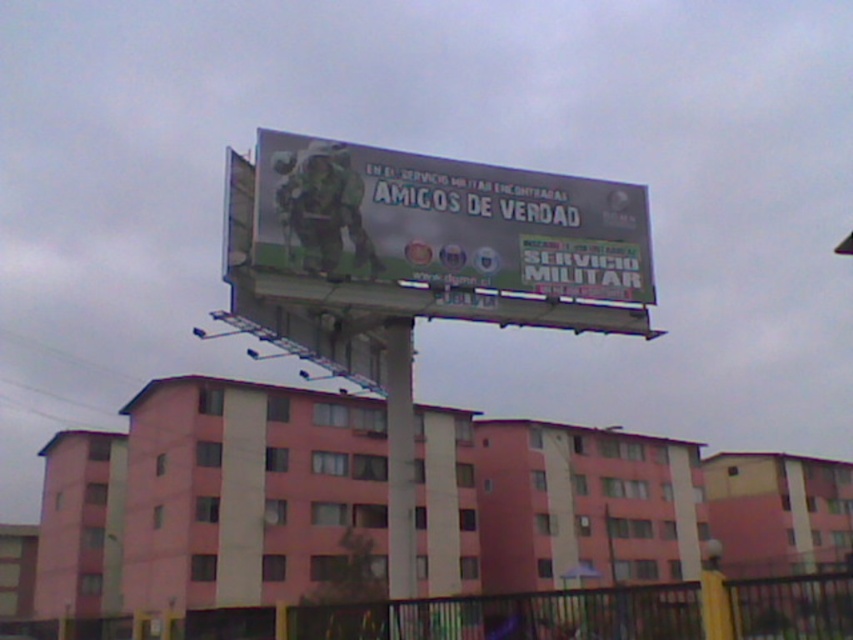
Looking at this image, you are a drone operator trying to capture a closeup of the metallic silver soldier at center on the billboard. The billboard is 10 meters wide and 5 meters tall. The soldier is placed at coordinates 0.347 in the x direction and 0.524 in the y direction. Calculate the exact position in meters from the bottom left corner of the billboard to the soldier. Round to the nearest centimeter.

The metallic silver soldier at center is located at x coordinate 0.347 multiplied by the billboard width of 10 meters, which equals 3.47 meters. The y coordinate 0.524 multiplied by the billboard height of 5 meters equals 2.62 meters. Therefore, the soldier is 3.47 meters from the left edge and 2.62 meters from the bottom edge of the billboard.

You are standing 10 meters away from the billboard. You want to touch the metallic silver soldier at center on the billboard. Can you reach it without moving closer? Explain why.

The metallic silver soldier at center is 17.76 meters away from the viewer. Since you are only 10 meters away from the billboard, you are closer than the soldier, but the soldier is part of the billboard itself. Therefore, you can reach the metallic silver soldier at center by moving forward 7.76 meters to bridge the distance.

You are a city planner analyzing the billboard. You notice the metallic silver soldier at center and the metallic pole at center. Which object takes up more area on the billboard?

The metallic pole at center takes up more area than the metallic silver soldier at center because the soldier occupies less space than the pole.